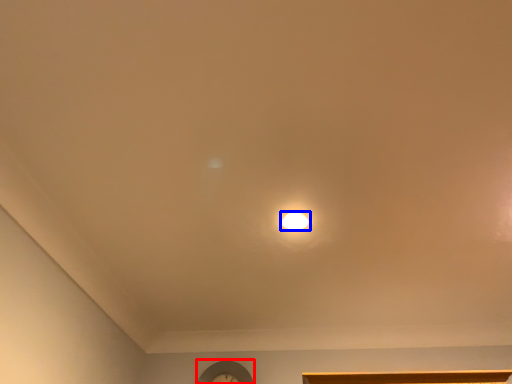
Question: Which object appears farthest to the camera in this image, clock (highlighted by a red box) or lamp (highlighted by a blue box)?

Choices:
 (A) clock
 (B) lamp

Answer: (A)